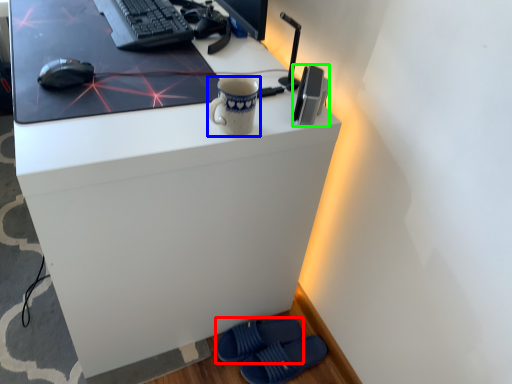
Question: Based on their relative distances, which object is nearer to footwear (highlighted by a red box)? Choose from mug (highlighted by a blue box) and gadget (highlighted by a green box).

Choices:
 (A) mug
 (B) gadget

Answer: (A)